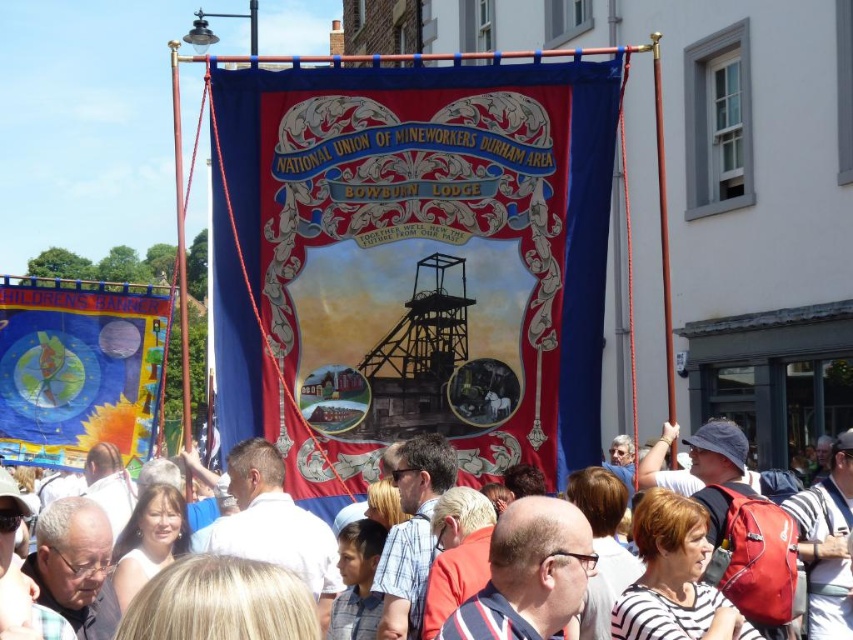
Question: Is blue fabric banner at left above white cotton shirt at center?

Choices:
 (A) no
 (B) yes

Answer: (B)

Question: Is silk banner at center wider than blue fabric banner at left?

Choices:
 (A) yes
 (B) no

Answer: (A)

Question: Which point is closer to the camera taking this photo?

Choices:
 (A) (811, 605)
 (B) (302, 273)
 (C) (149, 419)

Answer: (A)

Question: Considering the relative positions of silk banner at center and blue fabric banner at left in the image provided, where is silk banner at center located with respect to blue fabric banner at left?

Choices:
 (A) above
 (B) below

Answer: (A)

Question: Among these objects, which one is nearest to the camera?

Choices:
 (A) white cotton shirt at center
 (B) silk banner at center
 (C) blue fabric banner at left

Answer: (A)

Question: Which point is farther to the camera?

Choices:
 (A) (68, 307)
 (B) (537, 412)

Answer: (A)